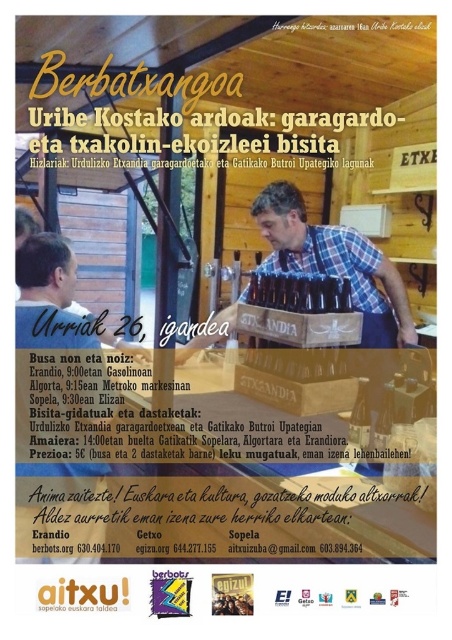
Question: Estimate the real-world distances between objects in this image. Which object is farther from the translucent glass bottle at center?

Choices:
 (A) plaid shirt at center
 (B) brown wooden crate at center

Answer: (A)

Question: Which of the following is the closest to the observer?

Choices:
 (A) (18, 317)
 (B) (282, 188)
 (C) (367, 401)

Answer: (C)

Question: Is brown wooden crate at center to the right of plaid shirt at center from the viewer's perspective?

Choices:
 (A) yes
 (B) no

Answer: (A)

Question: Does brown wooden crate at center appear on the right side of translucent glass bottle at center?

Choices:
 (A) yes
 (B) no

Answer: (B)

Question: Which is farther from the translucent glass bottle at center?

Choices:
 (A) brown wooden crate at center
 (B) plaid shirt at center

Answer: (B)

Question: Can you confirm if brown wooden crate at center is positioned above translucent glass bottle at center?

Choices:
 (A) yes
 (B) no

Answer: (A)